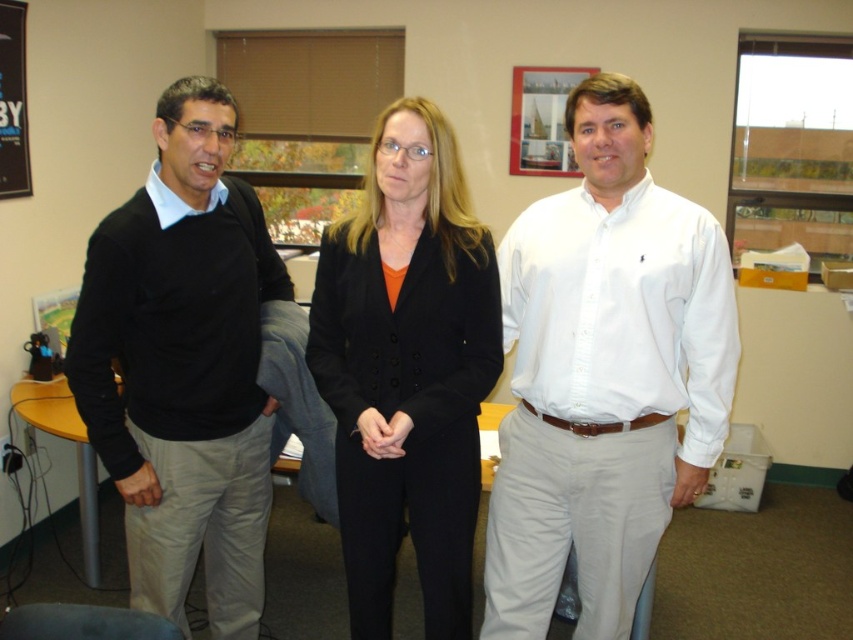
Does white cotton shirt at center appear over black sweater at left?

Yes.

The height and width of the screenshot is (640, 853). In order to click on white cotton shirt at center in this screenshot , I will do `click(604, 374)`.

The height and width of the screenshot is (640, 853). What are the coordinates of `white cotton shirt at center` in the screenshot? It's located at (604, 374).

Measure the distance between black sweater at left and camera.

black sweater at left and camera are 5.47 feet apart from each other.

Measure the distance between black sweater at left and camera.

black sweater at left and camera are 5.47 feet apart from each other.

Where is `black sweater at left`? The image size is (853, 640). black sweater at left is located at coordinates (183, 365).

Between white cotton shirt at center and black wool suit at center, which one has less height?

black wool suit at center

Is white cotton shirt at center closer to camera compared to black wool suit at center?

That is False.

The image size is (853, 640). I want to click on white cotton shirt at center, so click(604, 374).